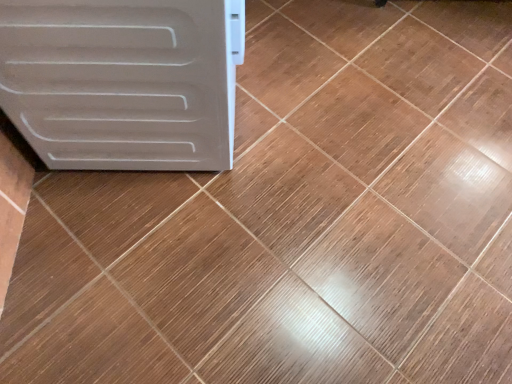
This screenshot has height=384, width=512. Identify the location of vacant space to the right of matte plastic door at lower left. (321, 111).